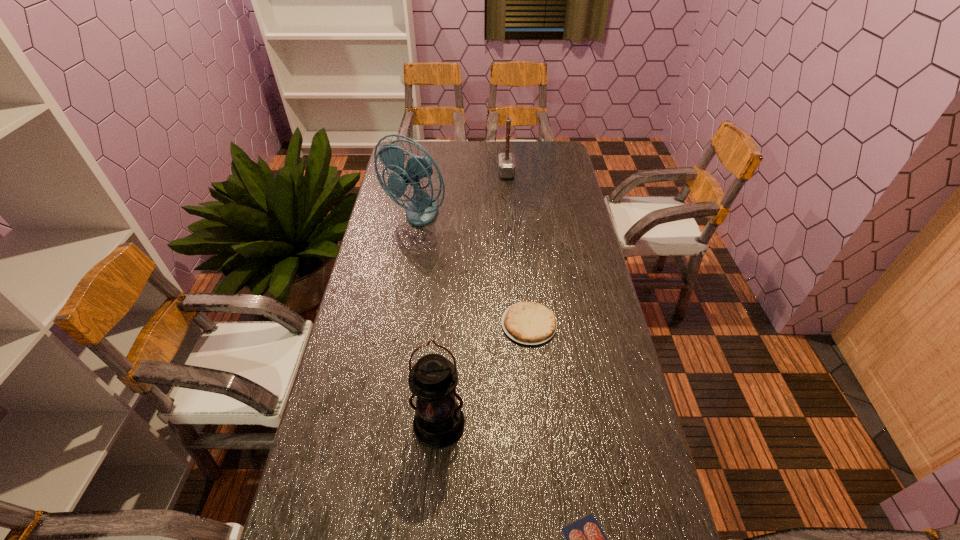
Identify the location of free space that is in between the second farthest object and the lantern. The width and height of the screenshot is (960, 540). click(427, 321).

The width and height of the screenshot is (960, 540). What are the coordinates of `vacant space that is in between the fan and the third tallest object` in the screenshot? It's located at (461, 194).

Image resolution: width=960 pixels, height=540 pixels. In order to click on vacant region between the third tallest object and the second nearest object in this screenshot , I will do `click(472, 299)`.

Identify the location of free space between the second shortest object and the second farthest object. Image resolution: width=960 pixels, height=540 pixels. (472, 270).

Image resolution: width=960 pixels, height=540 pixels. Find the location of `vacant space in between the third farthest object and the second tallest object`. vacant space in between the third farthest object and the second tallest object is located at coordinates (484, 375).

Locate which object is the second closest to the fan. Please provide its 2D coordinates. Your answer should be formatted as a tuple, i.e. [(x, y)], where the tuple contains the x and y coordinates of a point satisfying the conditions above.

[(530, 323)]

The height and width of the screenshot is (540, 960). What are the coordinates of `object that ranks as the second closest to the fan` in the screenshot? It's located at (530, 323).

Locate an element on the screen. The width and height of the screenshot is (960, 540). free point that satisfies the following two spatial constraints: 1. on the striking surface of the farthest object; 2. on the back side of the fourth tallest object is located at coordinates (518, 324).

Identify the location of free location that satisfies the following two spatial constraints: 1. on the striking surface of the third shortest object; 2. above the second nearest object, indicating its light source. The image size is (960, 540). (526, 426).

The width and height of the screenshot is (960, 540). What are the coordinates of `free point that satisfies the following two spatial constraints: 1. in front of the fourth nearest object to blow air; 2. on the right side of the second shortest object` in the screenshot? It's located at (396, 324).